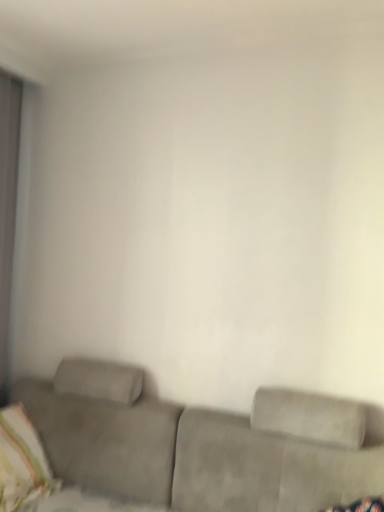
Question: Considering the relative positions of striped fabric pillow at lower left and suede couch at lower center in the image provided, is striped fabric pillow at lower left to the right of suede couch at lower center from the viewer's perspective?

Choices:
 (A) no
 (B) yes

Answer: (A)

Question: Does striped fabric pillow at lower left have a smaller size compared to suede couch at lower center?

Choices:
 (A) yes
 (B) no

Answer: (A)

Question: Is striped fabric pillow at lower left further to camera compared to suede couch at lower center?

Choices:
 (A) yes
 (B) no

Answer: (A)

Question: Is there a large distance between striped fabric pillow at lower left and suede couch at lower center?

Choices:
 (A) no
 (B) yes

Answer: (A)

Question: From a real-world perspective, is striped fabric pillow at lower left physically below suede couch at lower center?

Choices:
 (A) no
 (B) yes

Answer: (A)

Question: Can you confirm if striped fabric pillow at lower left is wider than suede couch at lower center?

Choices:
 (A) no
 (B) yes

Answer: (A)

Question: Is suede couch at lower center positioned with its back to striped fabric pillow at lower left?

Choices:
 (A) yes
 (B) no

Answer: (A)

Question: Considering the relative sizes of suede couch at lower center and striped fabric pillow at lower left in the image provided, is suede couch at lower center taller than striped fabric pillow at lower left?

Choices:
 (A) no
 (B) yes

Answer: (B)

Question: From the image's perspective, is suede couch at lower center under striped fabric pillow at lower left?

Choices:
 (A) yes
 (B) no

Answer: (A)

Question: Is suede couch at lower center not within striped fabric pillow at lower left?

Choices:
 (A) no
 (B) yes

Answer: (B)

Question: Considering the relative sizes of suede couch at lower center and striped fabric pillow at lower left in the image provided, is suede couch at lower center thinner than striped fabric pillow at lower left?

Choices:
 (A) yes
 (B) no

Answer: (B)

Question: From the image's perspective, is suede couch at lower center above striped fabric pillow at lower left?

Choices:
 (A) no
 (B) yes

Answer: (A)

Question: Is point (11, 463) positioned closer to the camera than point (230, 432)?

Choices:
 (A) farther
 (B) closer

Answer: (A)